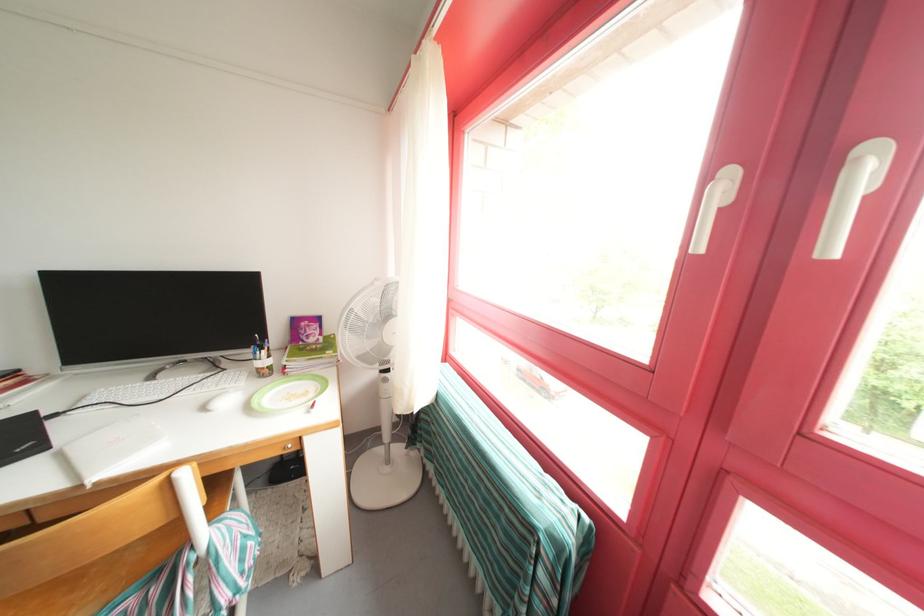
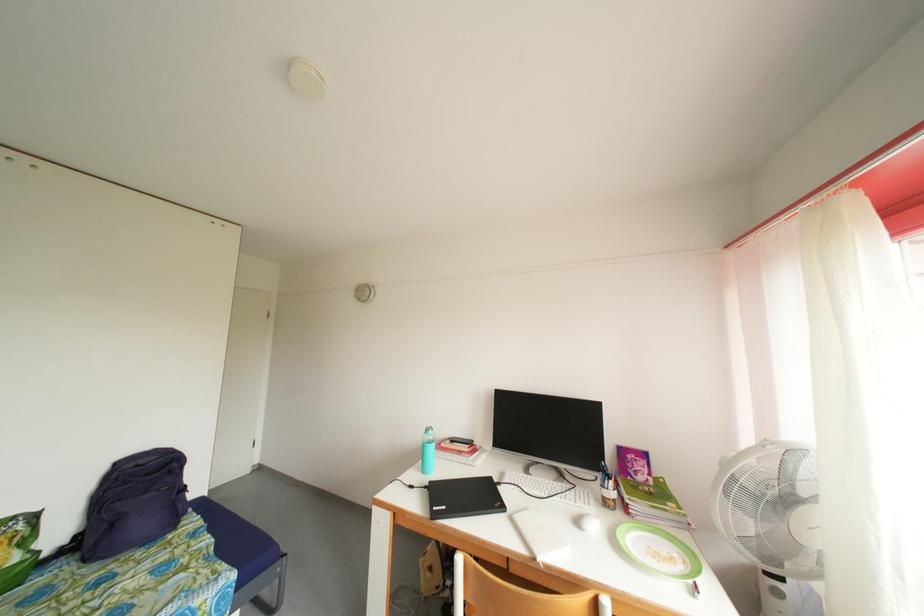
Find the pixel in the second image that matches pixel 319 402 in the first image.

(688, 573)